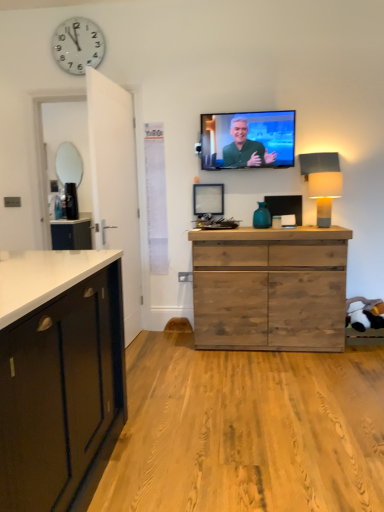
Question: Is white plastic clock at upper left a part of matte green screen at upper center?

Choices:
 (A) no
 (B) yes

Answer: (A)

Question: Does matte green screen at upper center come behind white plastic clock at upper left?

Choices:
 (A) yes
 (B) no

Answer: (B)

Question: From the image's perspective, does matte green screen at upper center appear lower than white plastic clock at upper left?

Choices:
 (A) yes
 (B) no

Answer: (A)

Question: Is matte green screen at upper center not inside white plastic clock at upper left?

Choices:
 (A) yes
 (B) no

Answer: (A)

Question: Can you confirm if matte green screen at upper center is wider than white plastic clock at upper left?

Choices:
 (A) no
 (B) yes

Answer: (B)

Question: Considering the relative sizes of matte green screen at upper center and white plastic clock at upper left in the image provided, is matte green screen at upper center thinner than white plastic clock at upper left?

Choices:
 (A) no
 (B) yes

Answer: (A)

Question: From the image's perspective, does blue glass vase at center appear lower than matte gray lampshade at right?

Choices:
 (A) no
 (B) yes

Answer: (B)

Question: From a real-world perspective, is blue glass vase at center under matte gray lampshade at right?

Choices:
 (A) no
 (B) yes

Answer: (B)

Question: Considering the relative sizes of blue glass vase at center and matte gray lampshade at right in the image provided, is blue glass vase at center thinner than matte gray lampshade at right?

Choices:
 (A) no
 (B) yes

Answer: (B)

Question: Does blue glass vase at center turn towards matte gray lampshade at right?

Choices:
 (A) no
 (B) yes

Answer: (A)

Question: Is blue glass vase at center to the right of matte gray lampshade at right from the viewer's perspective?

Choices:
 (A) yes
 (B) no

Answer: (B)

Question: Does blue glass vase at center have a smaller size compared to matte gray lampshade at right?

Choices:
 (A) no
 (B) yes

Answer: (B)

Question: Would you say matte green screen at upper center is a long distance from matte gray lampshade at right?

Choices:
 (A) no
 (B) yes

Answer: (A)